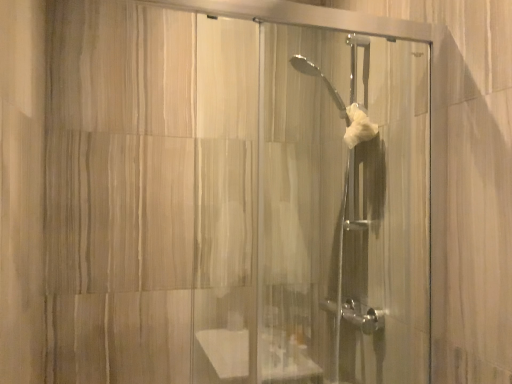
Question: From the image's perspective, is white fluffy hand towel at center located above or below clear glass shower door at center?

Choices:
 (A) above
 (B) below

Answer: (A)

Question: Based on their sizes in the image, would you say white fluffy hand towel at center is bigger or smaller than clear glass shower door at center?

Choices:
 (A) small
 (B) big

Answer: (A)

Question: From a real-world perspective, is white fluffy hand towel at center positioned above or below clear glass shower door at center?

Choices:
 (A) above
 (B) below

Answer: (A)

Question: Based on their positions, is clear glass shower door at center located to the left or right of white fluffy hand towel at center?

Choices:
 (A) left
 (B) right

Answer: (A)

Question: Considering the positions of clear glass shower door at center and white fluffy hand towel at center in the image, is clear glass shower door at center taller or shorter than white fluffy hand towel at center?

Choices:
 (A) short
 (B) tall

Answer: (B)

Question: Is point (267, 347) positioned closer to the camera than point (372, 134)?

Choices:
 (A) farther
 (B) closer

Answer: (B)

Question: From the image's perspective, is clear glass shower door at center located above or below white fluffy hand towel at center?

Choices:
 (A) below
 (B) above

Answer: (A)